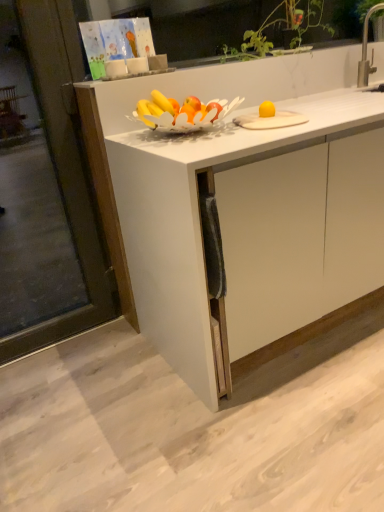
Question: Is white matte cabinet at center positioned behind silver metallic faucet at upper right?

Choices:
 (A) yes
 (B) no

Answer: (B)

Question: Is white matte cabinet at center completely or partially outside of silver metallic faucet at upper right?

Choices:
 (A) no
 (B) yes

Answer: (B)

Question: From the image's perspective, is white matte cabinet at center under silver metallic faucet at upper right?

Choices:
 (A) yes
 (B) no

Answer: (A)

Question: From the image's perspective, would you say white matte cabinet at center is positioned over silver metallic faucet at upper right?

Choices:
 (A) yes
 (B) no

Answer: (B)

Question: Does white matte cabinet at center have a lesser height compared to silver metallic faucet at upper right?

Choices:
 (A) yes
 (B) no

Answer: (B)

Question: From the image's perspective, is transparent glass screen door at left located above or below silver metallic faucet at upper right?

Choices:
 (A) above
 (B) below

Answer: (B)

Question: In the image, is transparent glass screen door at left positioned in front of or behind silver metallic faucet at upper right?

Choices:
 (A) front
 (B) behind

Answer: (A)

Question: Considering the positions of transparent glass screen door at left and silver metallic faucet at upper right in the image, is transparent glass screen door at left bigger or smaller than silver metallic faucet at upper right?

Choices:
 (A) small
 (B) big

Answer: (B)

Question: Choose the correct answer: Is transparent glass screen door at left inside silver metallic faucet at upper right or outside it?

Choices:
 (A) inside
 (B) outside

Answer: (B)

Question: Looking at the image, does white matte cabinet at center seem bigger or smaller compared to silver metallic faucet at upper right?

Choices:
 (A) big
 (B) small

Answer: (A)

Question: Does point (119, 215) appear closer or farther from the camera than point (364, 48)?

Choices:
 (A) closer
 (B) farther

Answer: (A)

Question: In the image, is white matte cabinet at center positioned in front of or behind silver metallic faucet at upper right?

Choices:
 (A) front
 (B) behind

Answer: (A)

Question: Is white matte cabinet at center taller or shorter than silver metallic faucet at upper right?

Choices:
 (A) tall
 (B) short

Answer: (A)

Question: In terms of size, does silver metallic faucet at upper right appear bigger or smaller than white matte cabinet at center?

Choices:
 (A) small
 (B) big

Answer: (A)

Question: Is silver metallic faucet at upper right inside or outside of white matte cabinet at center?

Choices:
 (A) inside
 (B) outside

Answer: (B)